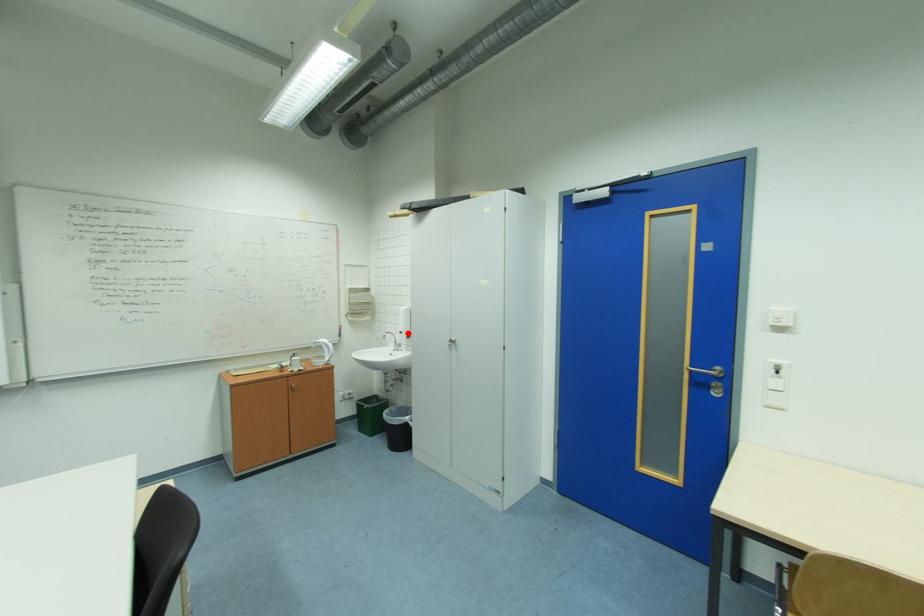
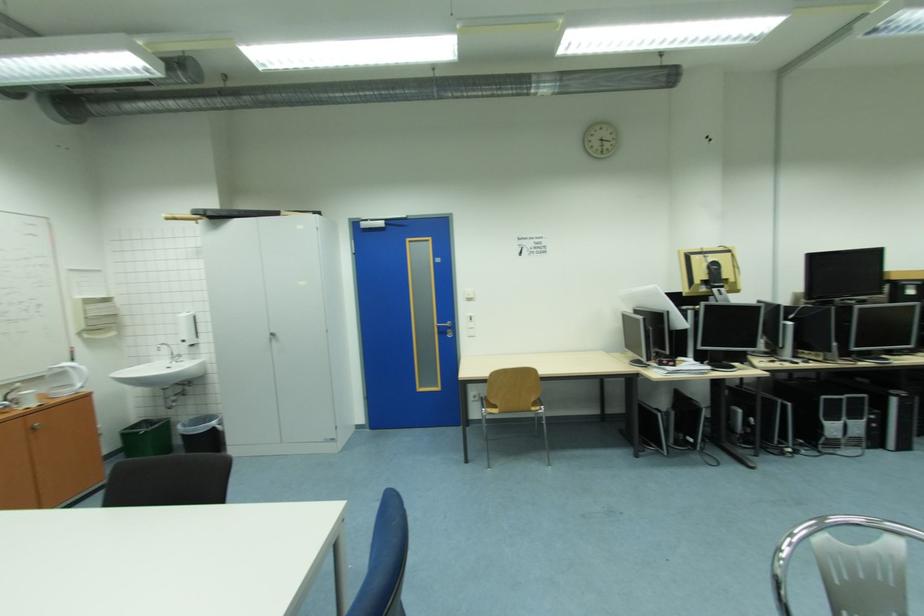
Find the pixel in the second image that matches the highlighted location in the first image.

(189, 342)